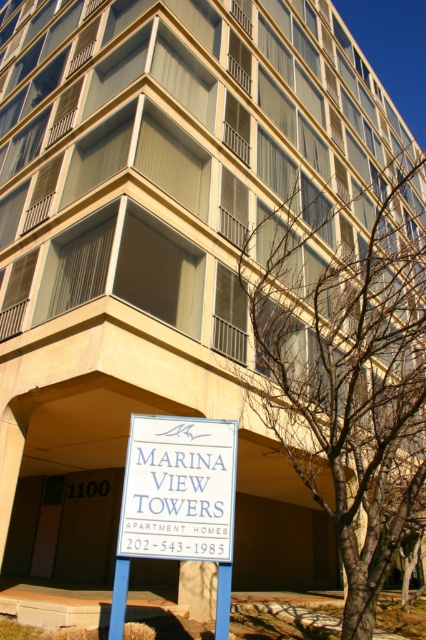
Question: Among these objects, which one is nearest to the camera?

Choices:
 (A) bare branches at center
 (B) white plastic sign at lower center

Answer: (B)

Question: Is bare branches at center to the right of white plastic sign at lower center from the viewer's perspective?

Choices:
 (A) yes
 (B) no

Answer: (A)

Question: Among these points, which one is farthest from the camera?

Choices:
 (A) (291, 262)
 (B) (137, 506)

Answer: (A)

Question: Is bare branches at center bigger than white plastic sign at lower center?

Choices:
 (A) yes
 (B) no

Answer: (A)

Question: Is bare branches at center positioned at the back of white plastic sign at lower center?

Choices:
 (A) no
 (B) yes

Answer: (B)